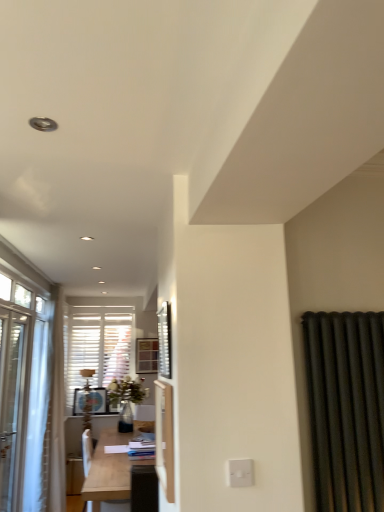
You are a GUI agent. You are given a task and a screenshot of the screen. Output one action in this format:
    pyautogui.click(x=<x>, y=<y>)
    Task: Click on the light wood table at center
    
    Given the screenshot: What is the action you would take?
    (108, 471)

Find the location of a particular element. white plastic switch at lower center is located at coordinates (240, 473).

Considering the sizes of white glossy screen door at center and light wood table at center in the image, is white glossy screen door at center wider or thinner than light wood table at center?

In the image, white glossy screen door at center appears to be more narrow than light wood table at center.

Is point (161, 474) closer to viewer compared to point (129, 466)?

Yes, point (161, 474) is closer to viewer.

Considering the relative sizes of white glossy screen door at center and light wood table at center in the image provided, is white glossy screen door at center shorter than light wood table at center?

Yes, white glossy screen door at center is shorter than light wood table at center.

Locate an element on the screen. The width and height of the screenshot is (384, 512). screen door above the light wood table at center (from a real-world perspective) is located at coordinates (164, 437).

Is metallic silver window screen at center in contact with white glossy screen door at center?

metallic silver window screen at center is not next to white glossy screen door at center, and they're not touching.

Consider the image. Relative to white glossy screen door at center, is metallic silver window screen at center in front or behind?

In the image, metallic silver window screen at center appears behind white glossy screen door at center.

The image size is (384, 512). Find the location of `window screen located on the right of white glossy screen door at center`. window screen located on the right of white glossy screen door at center is located at coordinates (164, 340).

From a real-world perspective, which object rests below the other?

white glossy screen door at center.

Relative to white plastic switch at lower center, is metallic silver window screen at center in front or behind?

metallic silver window screen at center is behind white plastic switch at lower center.

Considering the relative sizes of metallic silver window screen at center and white plastic switch at lower center in the image provided, is metallic silver window screen at center taller than white plastic switch at lower center?

Yes, metallic silver window screen at center is taller than white plastic switch at lower center.

Is metallic silver window screen at center touching white plastic switch at lower center?

No.

Who is bigger, light wood table at center or white plastic switch at lower center?

Bigger between the two is light wood table at center.

From a real-world perspective, is light wood table at center on white plastic switch at lower center?

Incorrect, from a real-world perspective, light wood table at center is lower than white plastic switch at lower center.

What's the angular difference between light wood table at center and white plastic switch at lower center's facing directions?

There is a 89.4-degree angle between the facing directions of light wood table at center and white plastic switch at lower center.

Is light wood table at center oriented towards white plastic switch at lower center?

No, light wood table at center is not facing towards white plastic switch at lower center.

Is there a large distance between white plastic switch at lower center and white glossy screen door at center?

No, white plastic switch at lower center is not far from white glossy screen door at center.

Which point is more distant from viewer, (234,467) or (170,428)?

Positioned behind is point (170,428).

Does white plastic switch at lower center appear on the right side of white glossy screen door at center?

Yes.

From a real-world perspective, which is physically below, white plastic switch at lower center or white glossy screen door at center?

white plastic switch at lower center.

From a real-world perspective, is white glossy screen door at center above or below metallic silver window screen at center?

white glossy screen door at center is situated lower than metallic silver window screen at center in the real world.

Is white glossy screen door at center located outside metallic silver window screen at center?

Yes, white glossy screen door at center is outside of metallic silver window screen at center.

Is the depth of white glossy screen door at center less than that of metallic silver window screen at center?

Yes, white glossy screen door at center is closer to the camera.

Is white glossy screen door at center touching metallic silver window screen at center?

No.

Is white glossy screen door at center directly adjacent to white plastic switch at lower center?

No, white glossy screen door at center is not with white plastic switch at lower center.

Is white glossy screen door at center bigger or smaller than white plastic switch at lower center?

Clearly, white glossy screen door at center is larger in size than white plastic switch at lower center.

Locate an element on the screen. The image size is (384, 512). screen door behind the white plastic switch at lower center is located at coordinates 164,437.

This screenshot has height=512, width=384. What are the coordinates of `screen door lying in front of the light wood table at center` in the screenshot? It's located at (164, 437).

This screenshot has height=512, width=384. Identify the location of screen door to the left of metallic silver window screen at center. (164, 437).

Looking at the image, which one is located further to white plastic switch at lower center, metallic silver window screen at center or white glossy screen door at center?

metallic silver window screen at center.

Which object lies nearer to the anchor point white glossy screen door at center, light wood table at center or metallic silver window screen at center?

metallic silver window screen at center.

Which object lies further to the anchor point metallic silver window screen at center, light wood table at center or white glossy screen door at center?

The object further to metallic silver window screen at center is light wood table at center.

From the image, which object appears to be farther from white plastic switch at lower center, metallic silver window screen at center or light wood table at center?

light wood table at center is further to white plastic switch at lower center.

Considering their positions, is white plastic switch at lower center positioned further to metallic silver window screen at center than light wood table at center?

Based on the image, light wood table at center appears to be further to metallic silver window screen at center.

Which object lies further to the anchor point light wood table at center, white glossy screen door at center or white plastic switch at lower center?

white plastic switch at lower center is positioned further to the anchor light wood table at center.

Which object lies further to the anchor point metallic silver window screen at center, white plastic switch at lower center or white glossy screen door at center?

The object further to metallic silver window screen at center is white plastic switch at lower center.

Estimate the real-world distances between objects in this image. Which object is closer to white plastic switch at lower center, light wood table at center or metallic silver window screen at center?

metallic silver window screen at center lies closer to white plastic switch at lower center than the other object.

Find the location of `screen door between white plastic switch at lower center and light wood table at center along the z-axis`. screen door between white plastic switch at lower center and light wood table at center along the z-axis is located at coordinates (164, 437).

Find the location of `window screen positioned between white plastic switch at lower center and light wood table at center from near to far`. window screen positioned between white plastic switch at lower center and light wood table at center from near to far is located at coordinates (164, 340).

The image size is (384, 512). I want to click on window screen between white glossy screen door at center and light wood table at center in the front-back direction, so [164, 340].

The image size is (384, 512). I want to click on electric outlet that lies between metallic silver window screen at center and white glossy screen door at center from top to bottom, so 240,473.